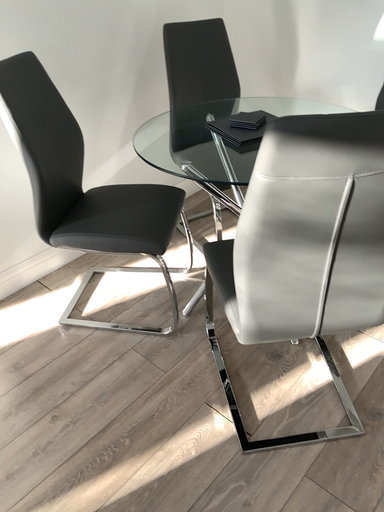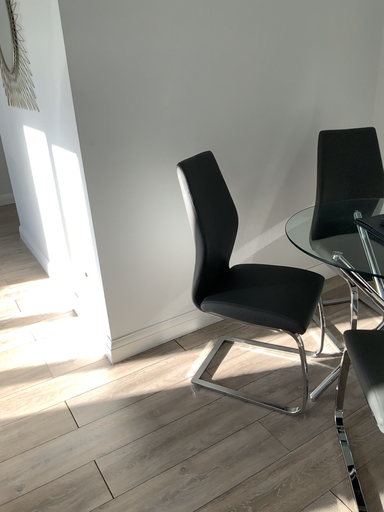
Question: Which way did the camera rotate in the video?

Choices:
 (A) rotated left
 (B) rotated right

Answer: (A)